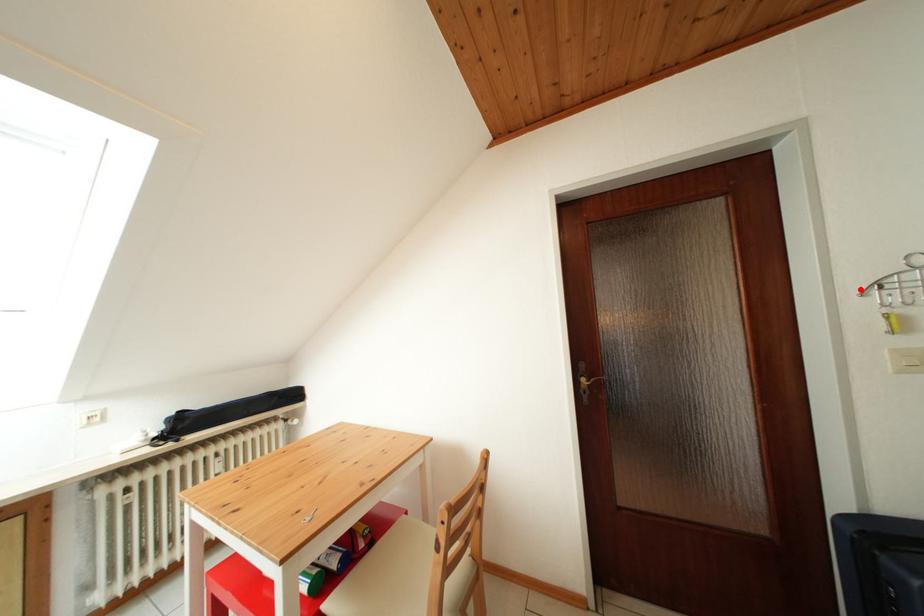
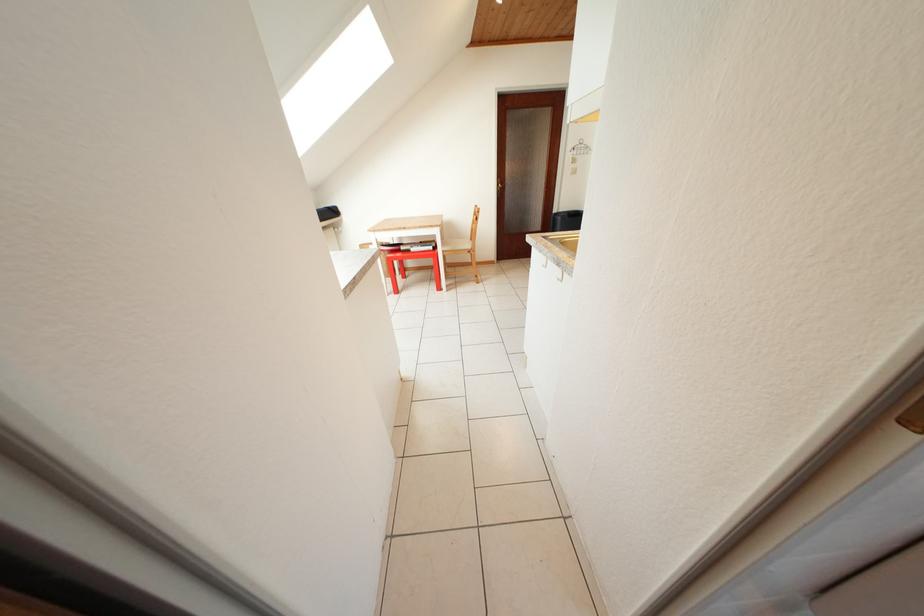
Question: I am providing you with two images of the same scene from different viewpoints. Image1 has a red point marked. In image2, the corresponding 3D location appears at what relative position? Reply with the corresponding letter.

Choices:
 (A) Closer
 (B) Farther

Answer: (A)